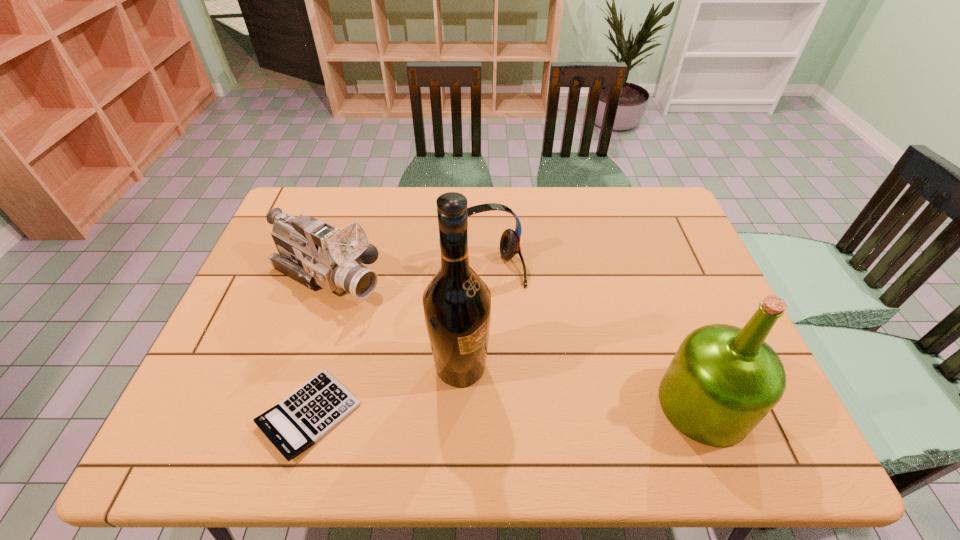
The height and width of the screenshot is (540, 960). What are the coordinates of `calculator` in the screenshot? It's located at (299, 421).

Locate an element on the screen. The height and width of the screenshot is (540, 960). olive oil is located at coordinates (723, 380).

At what (x,y) coordinates should I click in order to perform the action: click on the rightmost object. Please return your answer as a coordinate pair (x, y). Looking at the image, I should click on (723, 380).

The image size is (960, 540). I want to click on camcorder, so click(314, 253).

Where is `headset`? headset is located at coordinates (510, 240).

This screenshot has height=540, width=960. Find the location of `the tallest object`. the tallest object is located at coordinates (457, 303).

What are the coordinates of `free location located 0.170m on the left of the rightmost object` in the screenshot? It's located at (584, 404).

Locate an element on the screen. vacant space located on the front-facing side of the camcorder is located at coordinates (464, 349).

The height and width of the screenshot is (540, 960). What are the coordinates of `free spot located 0.160m on the front-facing side of the camcorder` in the screenshot? It's located at (417, 322).

Find the location of a particular element. This screenshot has width=960, height=540. vacant space located 0.120m on the front-facing side of the camcorder is located at coordinates (405, 315).